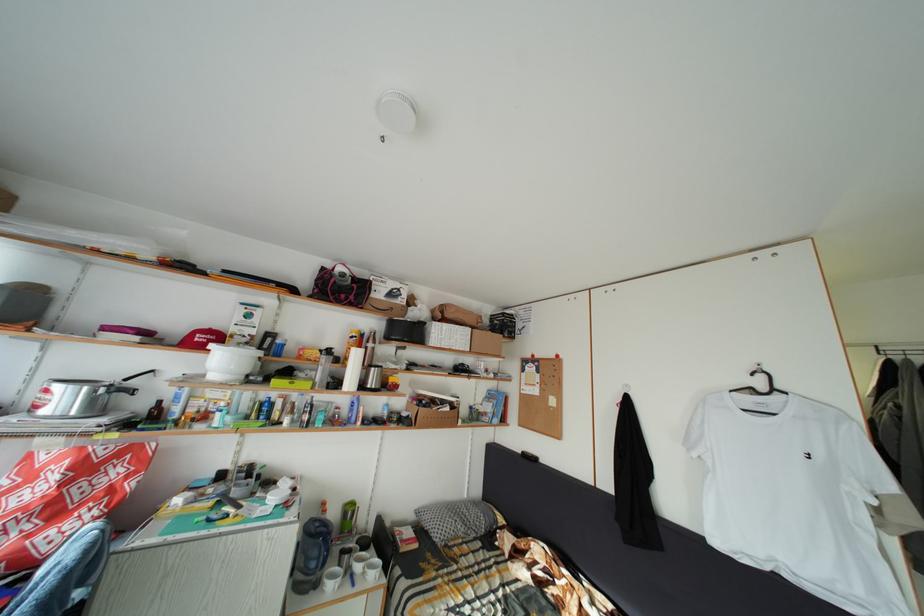
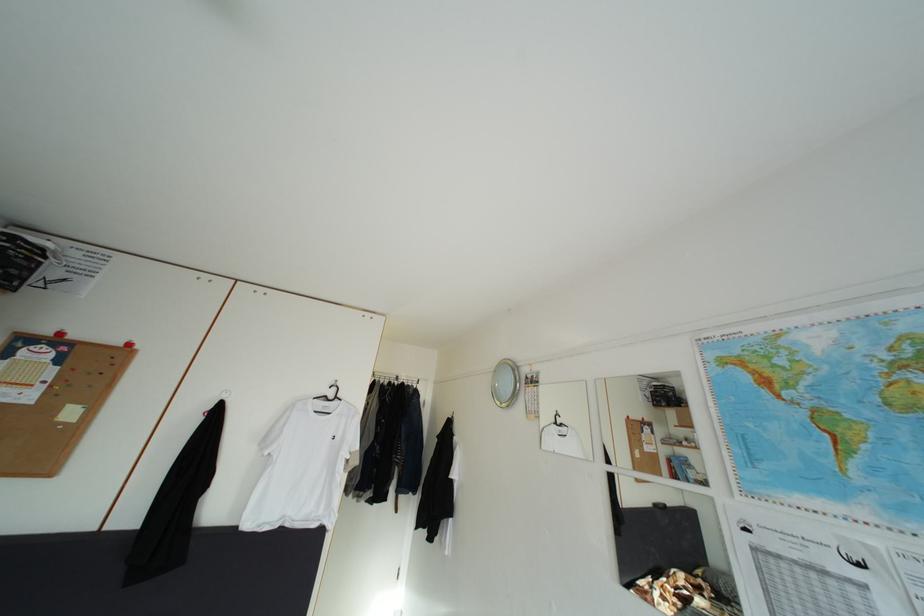
Find the pixel in the second image that matches point 768,390 in the first image.

(339, 400)